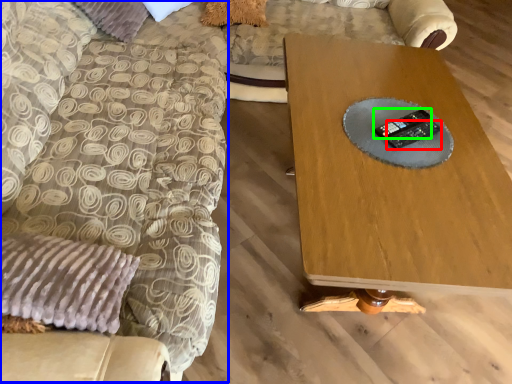
Question: Based on their relative distances, which object is farther from control (highlighted by a red box)? Choose from swivel chair (highlighted by a blue box) and control (highlighted by a green box).

Choices:
 (A) swivel chair
 (B) control

Answer: (A)